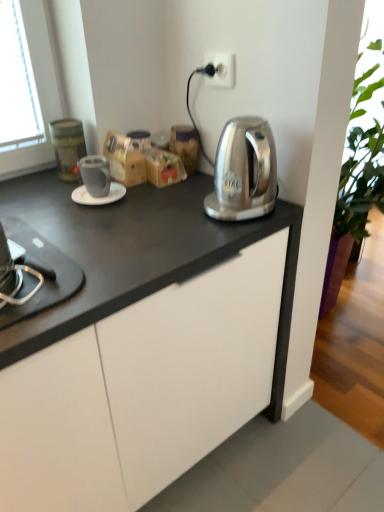
Question: Based on their positions, is matte gray mug at center-left located to the left or right of white glossy saucer at center?

Choices:
 (A) left
 (B) right

Answer: (B)

Question: From the image's perspective, is matte gray mug at center-left located above or below white glossy saucer at center?

Choices:
 (A) below
 (B) above

Answer: (B)

Question: Which of these objects is positioned closest to the white glossy saucer at center?

Choices:
 (A) black glass stovetop at lower left
 (B) white plastic electric outlet at upper center
 (C) satin silver kettle at center
 (D) brown paper bag at center, the first cabinetry positioned from the right
 (E) brown cardboard box at center

Answer: (E)

Question: Which object is positioned closest to the white matte cabinet at center, the first cabinetry positioned from the left?

Choices:
 (A) white glossy saucer at center
 (B) brown cardboard box at center
 (C) brown paper bag at center, positioned as the 2th cabinetry in front-to-back order
 (D) satin silver kettle at center
 (E) black glass stovetop at lower left

Answer: (E)